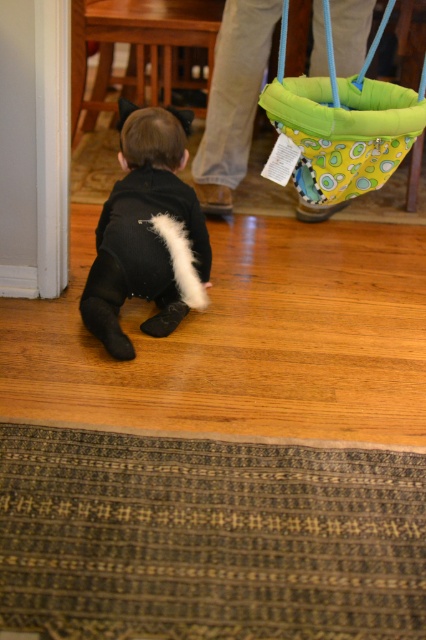
Question: Among these points, which one is nearest to the camera?

Choices:
 (A) (382, 154)
 (B) (118, 200)

Answer: (A)

Question: Is black soft plush at center thinner than green fabric hammock at upper right?

Choices:
 (A) yes
 (B) no

Answer: (A)

Question: In this image, where is black soft plush at center located relative to green fabric hammock at upper right?

Choices:
 (A) above
 (B) below

Answer: (B)

Question: Is black soft plush at center bigger than green fabric hammock at upper right?

Choices:
 (A) yes
 (B) no

Answer: (A)